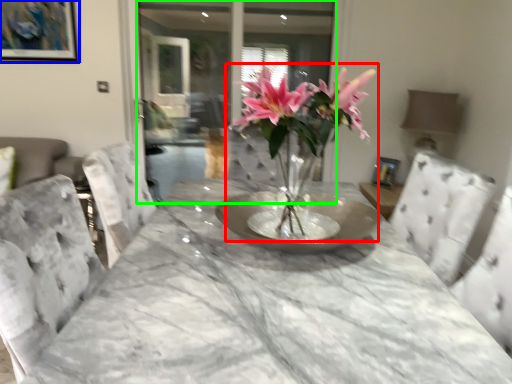
Question: Estimate the real-world distances between objects in this image. Which object is farther from houseplant (highlighted by a red box), picture frame (highlighted by a blue box) or glass door (highlighted by a green box)?

Choices:
 (A) picture frame
 (B) glass door

Answer: (B)